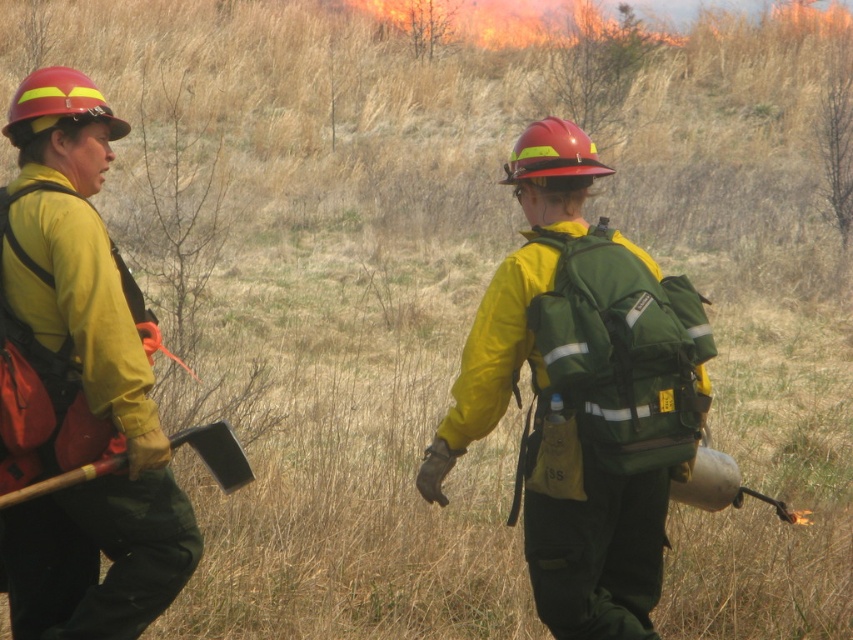
You are a drone operator trying to capture aerial footage of the firefighters. You need to ensure that both the green fabric backpack at center and the matte yellow jacket at left are clearly visible in the frame. Which object should you focus on first to ensure it doesn t get obscured by the other?

The green fabric backpack at center should be focused on first because it is closer to the viewer than the matte yellow jacket at left, so focusing on it first will prevent the matte yellow jacket at left from being obscured by the backpack.

You are a firefighter in the image and need to quickly grab an item from either the green fabric backpack at center or the matte yellow jacket at left. Which item can you access faster?

The matte yellow jacket at left can be accessed faster because it is smaller in size than the green fabric backpack at center, making it easier to handle quickly.

You are a firefighter in the grassland. You see a matte yellow jacket at left and a wooden handle axe at left. Which object is closer to your left side?

The matte yellow jacket at left is closer to your left side because it is positioned to the left of the wooden handle axe at left.